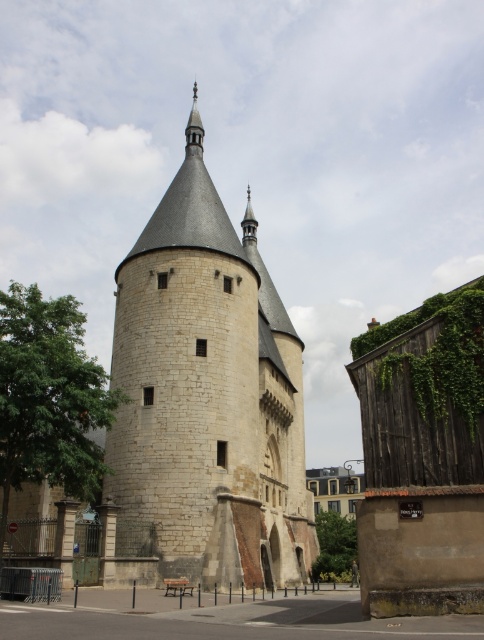
Question: Among these objects, which one is farthest from the camera?

Choices:
 (A) stone tower at center
 (B) green leafy ivy at right

Answer: (A)

Question: Can you confirm if stone tower at center is smaller than green leafy ivy at right?

Choices:
 (A) no
 (B) yes

Answer: (A)

Question: Among these objects, which one is nearest to the camera?

Choices:
 (A) stone tower at center
 (B) green leafy ivy at right

Answer: (B)

Question: Is stone tower at center further to camera compared to green leafy ivy at right?

Choices:
 (A) yes
 (B) no

Answer: (A)

Question: Is stone tower at center closer to camera compared to green leafy ivy at right?

Choices:
 (A) yes
 (B) no

Answer: (B)

Question: Among these points, which one is nearest to the camera?

Choices:
 (A) (220, 268)
 (B) (472, 317)

Answer: (B)